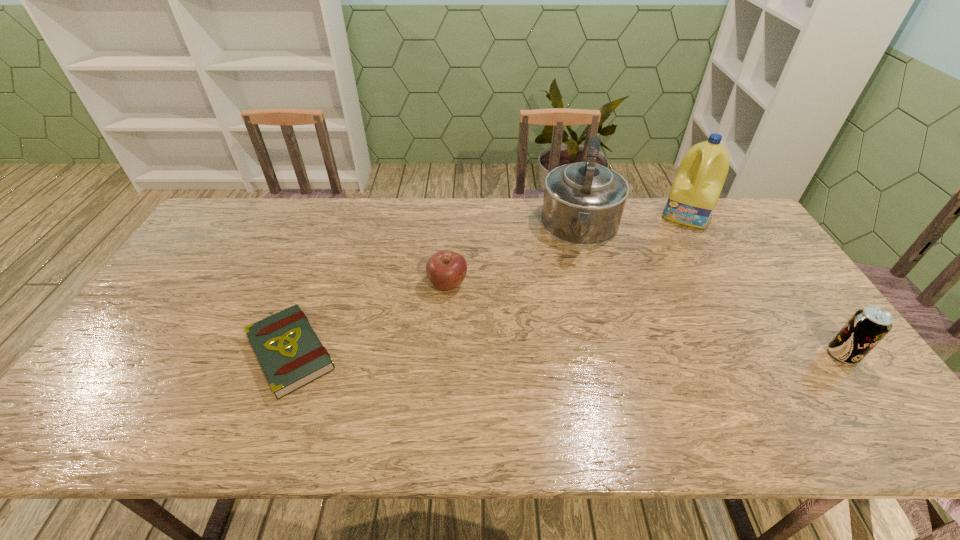
Where is `book`? book is located at coordinates (291, 355).

In order to click on the leftmost object in this screenshot , I will do `click(291, 355)`.

Find the location of `soda can`. soda can is located at coordinates (867, 327).

The height and width of the screenshot is (540, 960). What are the coordinates of `the rightmost object` in the screenshot? It's located at (867, 327).

Identify the location of apple. This screenshot has height=540, width=960. (446, 270).

Where is `the second shortest object`? The width and height of the screenshot is (960, 540). the second shortest object is located at coordinates pos(446,270).

Find the location of `the third object from left to right`. the third object from left to right is located at coordinates (583, 203).

Locate an element on the screen. the second object from right to left is located at coordinates (698, 183).

Locate an element on the screen. The height and width of the screenshot is (540, 960). free space located 0.210m on the back of the leftmost object is located at coordinates (325, 261).

The image size is (960, 540). Find the location of `free space located on the back of the third tallest object`. free space located on the back of the third tallest object is located at coordinates (793, 286).